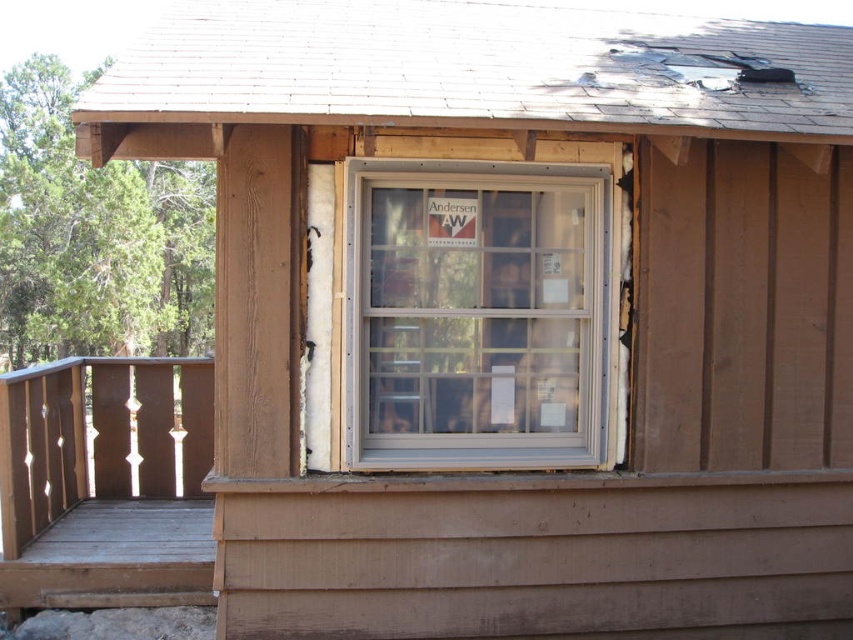
Question: Which object is farther from the camera taking this photo?

Choices:
 (A) wooden porch at lower left
 (B) white plastic window at center

Answer: (A)

Question: From the image, what is the correct spatial relationship of white plastic window at center in relation to wooden porch at lower left?

Choices:
 (A) below
 (B) above

Answer: (B)

Question: Is white plastic window at center wider than wooden porch at lower left?

Choices:
 (A) yes
 (B) no

Answer: (B)

Question: Is white plastic window at center to the right of wooden porch at lower left from the viewer's perspective?

Choices:
 (A) yes
 (B) no

Answer: (A)

Question: Which point is farther to the camera?

Choices:
 (A) (7, 474)
 (B) (578, 456)

Answer: (A)